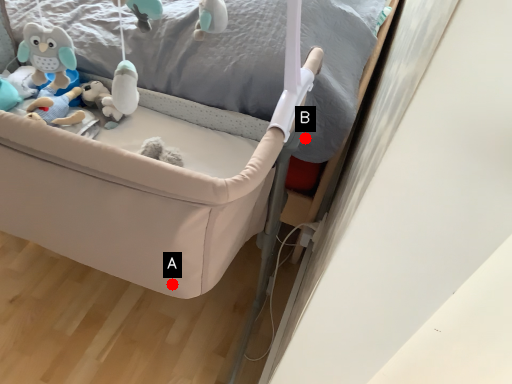
Question: Two points are circled on the image, labeled by A and B beside each circle. Among these points, which one is farthest from the camera?

Choices:
 (A) A is further
 (B) B is further

Answer: (B)